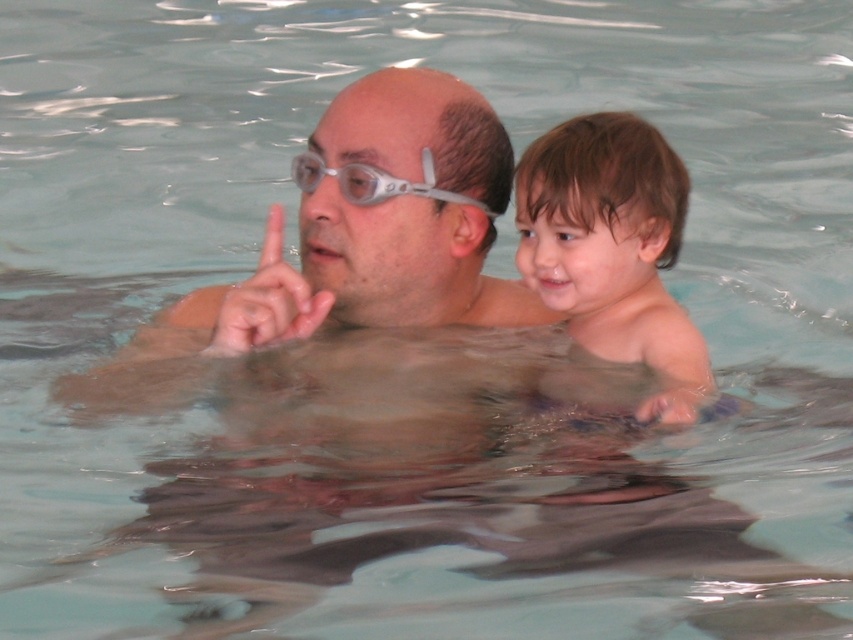
Does brown matte hair at upper right appear on the right side of clear plastic goggles at upper center?

Indeed, brown matte hair at upper right is positioned on the right side of clear plastic goggles at upper center.

Can you confirm if brown matte hair at upper right is taller than clear plastic goggles at upper center?

Correct, brown matte hair at upper right is much taller as clear plastic goggles at upper center.

What are the coordinates of `brown matte hair at upper right` in the screenshot? It's located at (x=613, y=250).